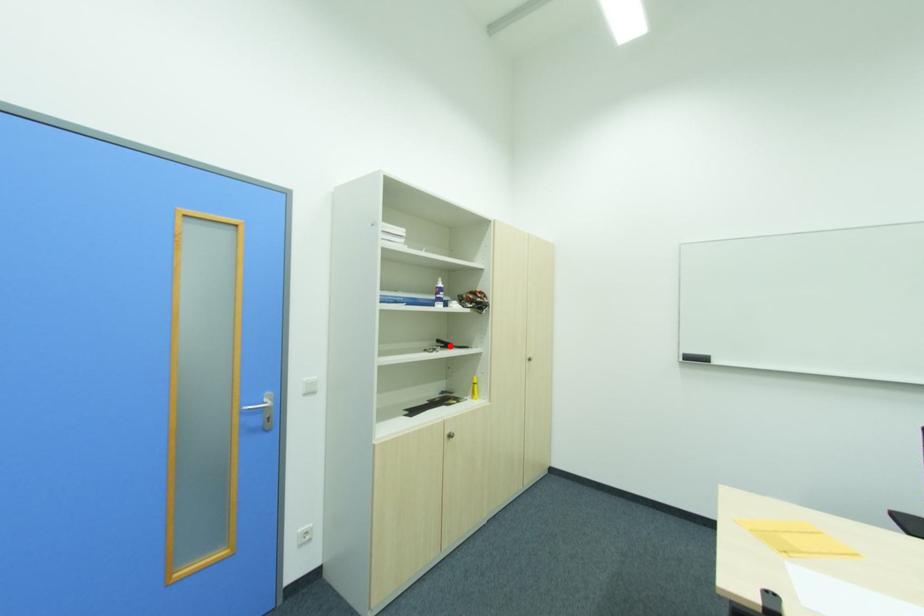
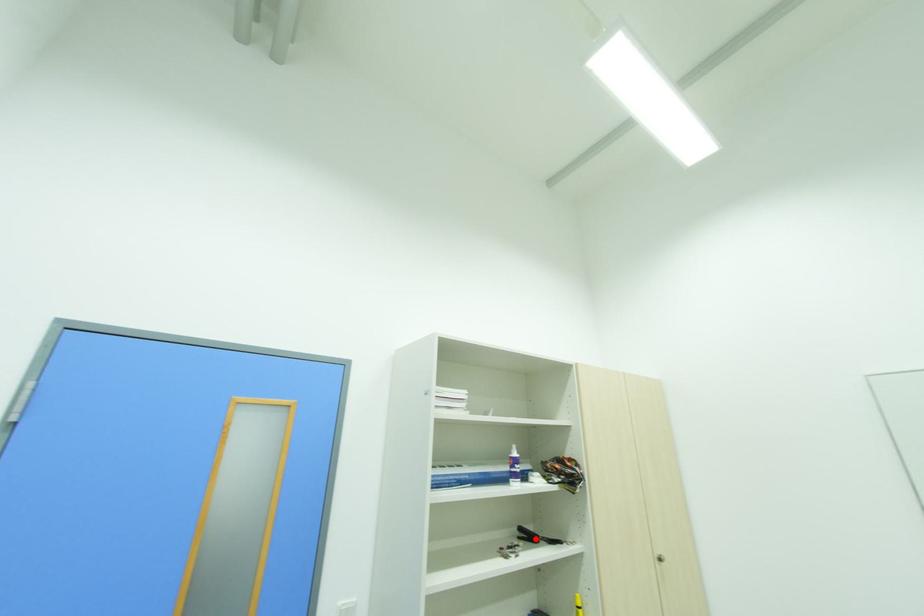
Looking at this image, I am providing you with two images of the same scene from different viewpoints. A red point is marked on the first image and another point is marked on the second image. Is the marked point in image1 the same physical position as the marked point in image2?

Yes